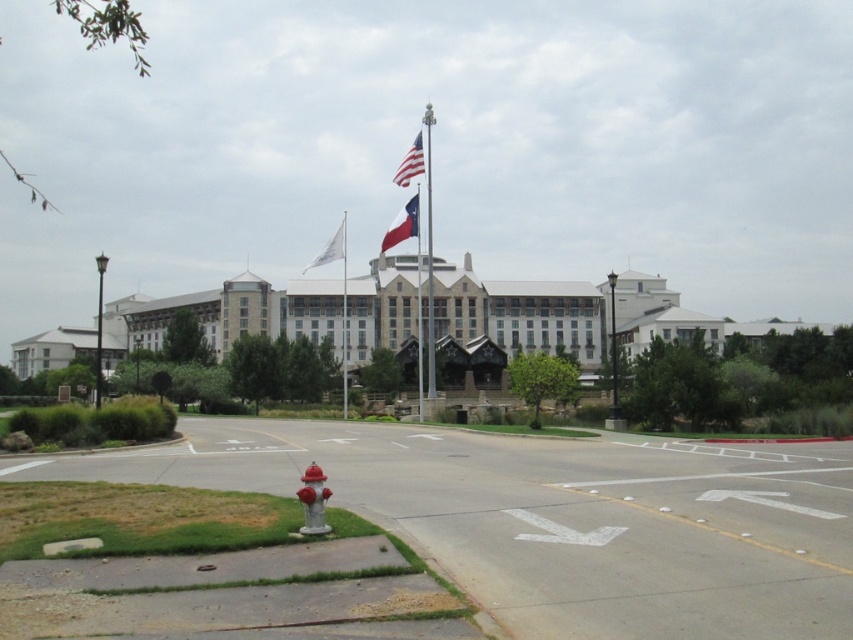
Question: Which of the following is the farthest from the observer?

Choices:
 (A) silver metallic fire hydrant at lower center
 (B) red fabric flag at center

Answer: (B)

Question: Does american flag at center have a smaller size compared to white fabric flag at center?

Choices:
 (A) no
 (B) yes

Answer: (B)

Question: Which of the following is the farthest from the observer?

Choices:
 (A) (343, 230)
 (B) (343, 368)
 (C) (302, 476)
 (D) (392, 244)

Answer: (A)

Question: Which object is positioned farthest from the white fabric flagpole at center?

Choices:
 (A) american flag at center
 (B) silver metallic fire hydrant at lower center
 (C) red fabric flag at center
 (D) metallic flag pole at center

Answer: (B)

Question: Does silver metallic fire hydrant at lower center appear on the right side of red fabric flag at center?

Choices:
 (A) no
 (B) yes

Answer: (B)

Question: Does red fabric flag at center have a smaller size compared to white fabric flagpole at center?

Choices:
 (A) yes
 (B) no

Answer: (A)